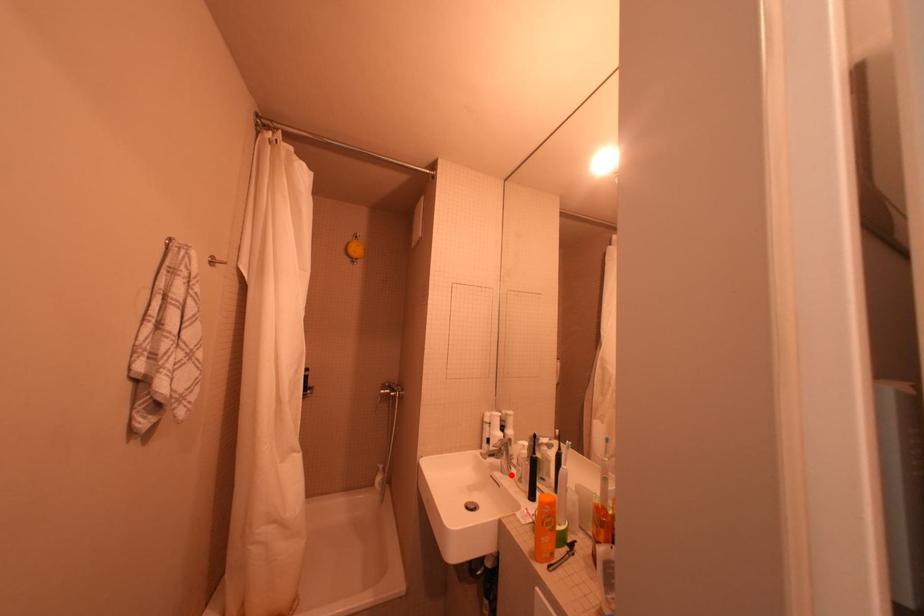
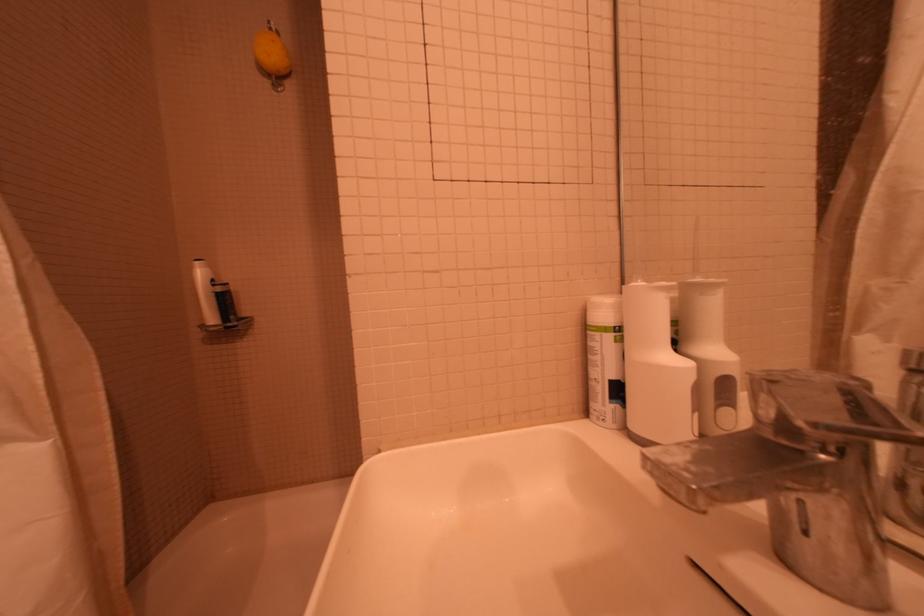
In the second image, find the point that corresponds to the highlighted location in the first image.

(831, 592)